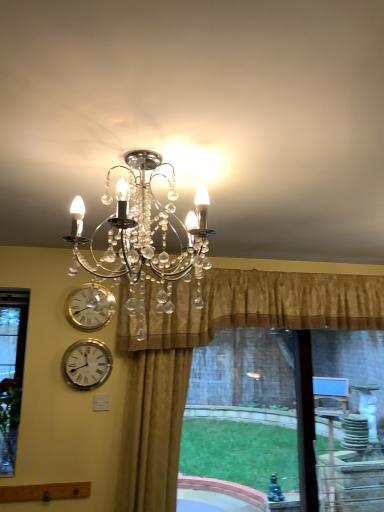
What is the approximate height of silver metallic wall clock at lower left, the 1th wall clock from the bottom?

11.73 inches.

What do you see at coordinates (144, 237) in the screenshot? I see `clear crystal chandelier at upper center` at bounding box center [144, 237].

Measure the distance between point (x=83, y=237) and camera.

The depth of point (x=83, y=237) is 4.00 feet.

Where is `silver metallic wall clock at lower left, marked as the second wall clock in a top-to-bottom arrangement`? The height and width of the screenshot is (512, 384). silver metallic wall clock at lower left, marked as the second wall clock in a top-to-bottom arrangement is located at coordinates (87, 364).

Is gold velvet curtain at center, the 1th curtain viewed from the left, oriented towards silver metallic wall clock at lower left, marked as the second wall clock in a top-to-bottom arrangement?

No, gold velvet curtain at center, the 1th curtain viewed from the left, is not turned towards silver metallic wall clock at lower left, marked as the second wall clock in a top-to-bottom arrangement.

Which of these two, gold velvet curtain at center, which appears as the 2th curtain when viewed from the right, or silver metallic wall clock at lower left, the 1th wall clock from the bottom, is bigger?

With larger size is gold velvet curtain at center, which appears as the 2th curtain when viewed from the right.

Can you confirm if gold velvet curtain at center, which appears as the 2th curtain when viewed from the right, is wider than silver metallic wall clock at lower left, marked as the second wall clock in a top-to-bottom arrangement?

Yes.

Between gold velvet curtain at center, which appears as the 2th curtain when viewed from the right, and silver metallic wall clock at lower left, the 1th wall clock from the bottom, which one has less height?

silver metallic wall clock at lower left, the 1th wall clock from the bottom, is shorter.

Does silver metallic wall clock at left, placed as the second wall clock when sorted from bottom to top, have a lesser width compared to gold textured curtain at upper center, marked as the 2th curtain in a left-to-right arrangement?

Yes, silver metallic wall clock at left, placed as the second wall clock when sorted from bottom to top, is thinner than gold textured curtain at upper center, marked as the 2th curtain in a left-to-right arrangement.

From a real-world perspective, which object stands above the other?

In real-world perspective, gold textured curtain at upper center, which is the 1th curtain in right-to-left order, is above.

Is silver metallic wall clock at left, positioned as the 1th wall clock in top-to-bottom order, oriented away from gold textured curtain at upper center, marked as the 2th curtain in a left-to-right arrangement?

No, silver metallic wall clock at left, positioned as the 1th wall clock in top-to-bottom order, is not facing away from gold textured curtain at upper center, marked as the 2th curtain in a left-to-right arrangement.

Is gold textured curtain at upper center, marked as the 2th curtain in a left-to-right arrangement, a part of silver metallic wall clock at left, positioned as the 1th wall clock in top-to-bottom order?

Actually, gold textured curtain at upper center, marked as the 2th curtain in a left-to-right arrangement, is outside silver metallic wall clock at left, positioned as the 1th wall clock in top-to-bottom order.

Is point (94, 339) positioned before point (121, 498)?

That is False.

From the image's perspective, which one is positioned higher, silver metallic wall clock at lower left, the 1th wall clock from the bottom, or gold velvet curtain at center, the 1th curtain viewed from the left?

From the image's view, silver metallic wall clock at lower left, the 1th wall clock from the bottom, is above.

How distant is silver metallic wall clock at lower left, marked as the second wall clock in a top-to-bottom arrangement, from gold velvet curtain at center, which appears as the 2th curtain when viewed from the right?

silver metallic wall clock at lower left, marked as the second wall clock in a top-to-bottom arrangement, is 14.33 inches from gold velvet curtain at center, which appears as the 2th curtain when viewed from the right.

Considering the sizes of objects silver metallic wall clock at lower left, marked as the second wall clock in a top-to-bottom arrangement, and gold velvet curtain at center, the 1th curtain viewed from the left, in the image provided, who is taller, silver metallic wall clock at lower left, marked as the second wall clock in a top-to-bottom arrangement, or gold velvet curtain at center, the 1th curtain viewed from the left,?

With more height is gold velvet curtain at center, the 1th curtain viewed from the left.

Is gold textured curtain at upper center, marked as the 2th curtain in a left-to-right arrangement, at the left side of clear crystal chandelier at upper center?

No, gold textured curtain at upper center, marked as the 2th curtain in a left-to-right arrangement, is not to the left of clear crystal chandelier at upper center.

Which is correct: gold textured curtain at upper center, which is the 1th curtain in right-to-left order, is inside clear crystal chandelier at upper center, or outside of it?

The correct answer is: outside.

Between silver metallic wall clock at left, positioned as the 1th wall clock in top-to-bottom order, and silver metallic wall clock at lower left, the 1th wall clock from the bottom, which one has smaller width?

With smaller width is silver metallic wall clock at left, positioned as the 1th wall clock in top-to-bottom order.

From the image's perspective, is silver metallic wall clock at left, positioned as the 1th wall clock in top-to-bottom order, located beneath silver metallic wall clock at lower left, marked as the second wall clock in a top-to-bottom arrangement?

No, from the image's perspective, silver metallic wall clock at left, positioned as the 1th wall clock in top-to-bottom order, is not beneath silver metallic wall clock at lower left, marked as the second wall clock in a top-to-bottom arrangement.

Considering the relative sizes of silver metallic wall clock at left, positioned as the 1th wall clock in top-to-bottom order, and silver metallic wall clock at lower left, marked as the second wall clock in a top-to-bottom arrangement, in the image provided, is silver metallic wall clock at left, positioned as the 1th wall clock in top-to-bottom order, shorter than silver metallic wall clock at lower left, marked as the second wall clock in a top-to-bottom arrangement,?

Correct, silver metallic wall clock at left, positioned as the 1th wall clock in top-to-bottom order, is not as tall as silver metallic wall clock at lower left, marked as the second wall clock in a top-to-bottom arrangement.

Is point (83, 350) positioned before point (90, 327)?

No, (83, 350) is further to viewer.

Which object is closer to the camera taking this photo, silver metallic wall clock at lower left, the 1th wall clock from the bottom, or silver metallic wall clock at left, positioned as the 1th wall clock in top-to-bottom order?

silver metallic wall clock at lower left, the 1th wall clock from the bottom, is closer to the camera.

From their relative heights in the image, would you say silver metallic wall clock at lower left, the 1th wall clock from the bottom, is taller or shorter than silver metallic wall clock at left, positioned as the 1th wall clock in top-to-bottom order?

Considering their sizes, silver metallic wall clock at lower left, the 1th wall clock from the bottom, has more height than silver metallic wall clock at left, positioned as the 1th wall clock in top-to-bottom order.

Is silver metallic wall clock at lower left, marked as the second wall clock in a top-to-bottom arrangement, turned away from silver metallic wall clock at left, placed as the second wall clock when sorted from bottom to top?

No, silver metallic wall clock at lower left, marked as the second wall clock in a top-to-bottom arrangement,'s orientation is not away from silver metallic wall clock at left, placed as the second wall clock when sorted from bottom to top.

Considering the relative positions of gold textured curtain at upper center, which is the 1th curtain in right-to-left order, and silver metallic wall clock at left, positioned as the 1th wall clock in top-to-bottom order, in the image provided, is gold textured curtain at upper center, which is the 1th curtain in right-to-left order, behind silver metallic wall clock at left, positioned as the 1th wall clock in top-to-bottom order,?

No, gold textured curtain at upper center, which is the 1th curtain in right-to-left order, is closer to the camera.

Considering the relative sizes of gold textured curtain at upper center, marked as the 2th curtain in a left-to-right arrangement, and silver metallic wall clock at left, positioned as the 1th wall clock in top-to-bottom order, in the image provided, is gold textured curtain at upper center, marked as the 2th curtain in a left-to-right arrangement, thinner than silver metallic wall clock at left, positioned as the 1th wall clock in top-to-bottom order,?

Incorrect, the width of gold textured curtain at upper center, marked as the 2th curtain in a left-to-right arrangement, is not less than that of silver metallic wall clock at left, positioned as the 1th wall clock in top-to-bottom order.

Is gold textured curtain at upper center, marked as the 2th curtain in a left-to-right arrangement, far from silver metallic wall clock at left, positioned as the 1th wall clock in top-to-bottom order?

Actually, gold textured curtain at upper center, marked as the 2th curtain in a left-to-right arrangement, and silver metallic wall clock at left, positioned as the 1th wall clock in top-to-bottom order, are a little close together.

Looking at this image, considering the sizes of objects gold textured curtain at upper center, marked as the 2th curtain in a left-to-right arrangement, and silver metallic wall clock at left, positioned as the 1th wall clock in top-to-bottom order, in the image provided, who is bigger, gold textured curtain at upper center, marked as the 2th curtain in a left-to-right arrangement, or silver metallic wall clock at left, positioned as the 1th wall clock in top-to-bottom order,?

Bigger between the two is gold textured curtain at upper center, marked as the 2th curtain in a left-to-right arrangement.

Locate an element on the screen. the 1st wall clock behind the gold velvet curtain at center, the 1th curtain viewed from the left is located at coordinates (87, 364).

Locate an element on the screen. This screenshot has width=384, height=512. curtain that is the 1st one when counting forward from the silver metallic wall clock at left, placed as the second wall clock when sorted from bottom to top is located at coordinates (254, 306).

Estimate the real-world distances between objects in this image. Which object is further from silver metallic wall clock at lower left, marked as the second wall clock in a top-to-bottom arrangement, clear crystal chandelier at upper center or gold textured curtain at upper center, marked as the 2th curtain in a left-to-right arrangement?

Result: The object further to silver metallic wall clock at lower left, marked as the second wall clock in a top-to-bottom arrangement, is clear crystal chandelier at upper center.

In the scene shown: Looking at the image, which one is located closer to silver metallic wall clock at left, positioned as the 1th wall clock in top-to-bottom order, clear crystal chandelier at upper center or gold velvet curtain at center, the 1th curtain viewed from the left?

gold velvet curtain at center, the 1th curtain viewed from the left, is positioned closer to the anchor silver metallic wall clock at left, positioned as the 1th wall clock in top-to-bottom order.

Which object lies nearer to the anchor point silver metallic wall clock at left, positioned as the 1th wall clock in top-to-bottom order, silver metallic wall clock at lower left, the 1th wall clock from the bottom, or gold velvet curtain at center, which appears as the 2th curtain when viewed from the right?

silver metallic wall clock at lower left, the 1th wall clock from the bottom, is closer to silver metallic wall clock at left, positioned as the 1th wall clock in top-to-bottom order.

Looking at the image, which one is located closer to silver metallic wall clock at lower left, the 1th wall clock from the bottom, gold velvet curtain at center, which appears as the 2th curtain when viewed from the right, or clear crystal chandelier at upper center?

gold velvet curtain at center, which appears as the 2th curtain when viewed from the right.

When comparing their distances from silver metallic wall clock at lower left, marked as the second wall clock in a top-to-bottom arrangement, does gold textured curtain at upper center, which is the 1th curtain in right-to-left order, or clear crystal chandelier at upper center seem further?

The object further to silver metallic wall clock at lower left, marked as the second wall clock in a top-to-bottom arrangement, is clear crystal chandelier at upper center.

Considering their positions, is silver metallic wall clock at left, positioned as the 1th wall clock in top-to-bottom order, positioned closer to clear crystal chandelier at upper center than gold textured curtain at upper center, marked as the 2th curtain in a left-to-right arrangement?

Among the two, silver metallic wall clock at left, positioned as the 1th wall clock in top-to-bottom order, is located nearer to clear crystal chandelier at upper center.

Based on their spatial positions, is silver metallic wall clock at left, placed as the second wall clock when sorted from bottom to top, or gold velvet curtain at center, which appears as the 2th curtain when viewed from the right, closer to clear crystal chandelier at upper center?

silver metallic wall clock at left, placed as the second wall clock when sorted from bottom to top.

Estimate the real-world distances between objects in this image. Which object is further from gold textured curtain at upper center, which is the 1th curtain in right-to-left order, clear crystal chandelier at upper center or silver metallic wall clock at left, positioned as the 1th wall clock in top-to-bottom order?

clear crystal chandelier at upper center.

At what (x,y) coordinates should I click in order to perform the action: click on wall clock situated between silver metallic wall clock at left, placed as the second wall clock when sorted from bottom to top, and gold textured curtain at upper center, marked as the 2th curtain in a left-to-right arrangement, from left to right. Please return your answer as a coordinate pair (x, y). This screenshot has width=384, height=512. Looking at the image, I should click on (87, 364).

I want to click on curtain between clear crystal chandelier at upper center and gold textured curtain at upper center, which is the 1th curtain in right-to-left order, in the front-back direction, so click(152, 429).

The width and height of the screenshot is (384, 512). What are the coordinates of `wall clock situated between silver metallic wall clock at left, placed as the second wall clock when sorted from bottom to top, and gold velvet curtain at center, which appears as the 2th curtain when viewed from the right, from left to right` in the screenshot? It's located at (87, 364).

Locate an element on the screen. Image resolution: width=384 pixels, height=512 pixels. curtain situated between silver metallic wall clock at lower left, marked as the second wall clock in a top-to-bottom arrangement, and gold textured curtain at upper center, marked as the 2th curtain in a left-to-right arrangement, from left to right is located at coordinates (152, 429).